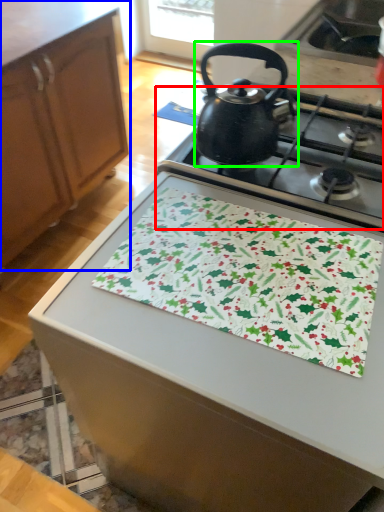
Question: Based on their relative distances, which object is farther from gas stove (highlighted by a red box)? Choose from cabinetry (highlighted by a blue box) and kettle (highlighted by a green box).

Choices:
 (A) cabinetry
 (B) kettle

Answer: (A)